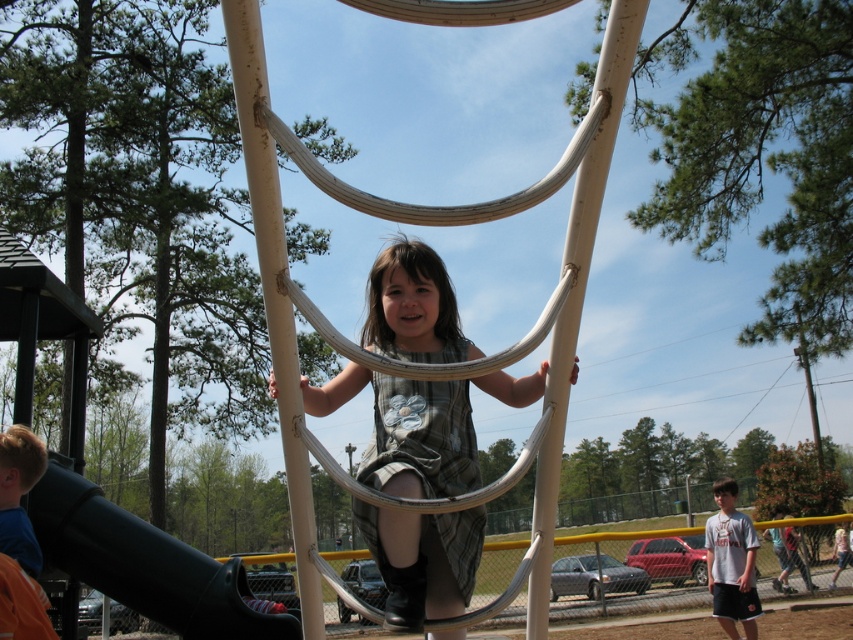
Question: Which of the following is the farthest from the observer?

Choices:
 (A) black rubber slide at lower left
 (B) matte gray dress at center

Answer: (A)

Question: Can you confirm if matte gray dress at center is positioned to the right of black rubber slide at lower left?

Choices:
 (A) yes
 (B) no

Answer: (A)

Question: Which object is closer to the camera taking this photo?

Choices:
 (A) matte gray dress at center
 (B) black rubber slide at lower left

Answer: (A)

Question: Is matte gray dress at center positioned before black rubber slide at lower left?

Choices:
 (A) yes
 (B) no

Answer: (A)

Question: Does matte gray dress at center appear on the left side of black rubber slide at lower left?

Choices:
 (A) yes
 (B) no

Answer: (B)